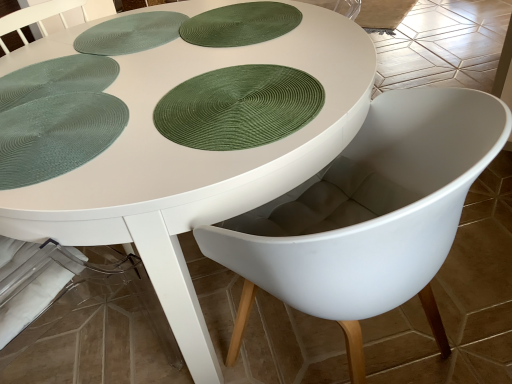
In order to click on white matte table at center in this screenshot , I will do `click(35, 14)`.

At what (x,y) coordinates should I click in order to perform the action: click on green woven placemat at center, which is counted as the third paper plate, starting from the top. Please return your answer as a coordinate pair (x, y). This screenshot has width=512, height=384. Looking at the image, I should click on (238, 107).

Where is `green textured placemat at upper left`? This screenshot has width=512, height=384. green textured placemat at upper left is located at coordinates coord(130,33).

Describe the element at coordinates (130, 33) in the screenshot. I see `green textured placemat at upper left` at that location.

At what (x,y) coordinates should I click in order to perform the action: click on green textured placemat at upper center, the 1th paper plate viewed from the top. Please return your answer as a coordinate pair (x, y). This screenshot has height=384, width=512. Looking at the image, I should click on (240, 24).

This screenshot has height=384, width=512. Identify the location of green textured placemat at upper left, which appears as the 3th paper plate when ordered from the bottom. (57, 79).

The height and width of the screenshot is (384, 512). What are the coordinates of `green textured placemat at left, marked as the fourth paper plate in a top-to-bottom arrangement` in the screenshot? It's located at (56, 135).

I want to click on white matte table at center, so pos(35,14).

Considering the positions of objects green textured placemat at upper left and white matte table at center in the image provided, who is behind, green textured placemat at upper left or white matte table at center?

Positioned behind is green textured placemat at upper left.

From a real-world perspective, is green textured placemat at upper left located beneath white matte table at center?

No, from a real-world perspective, green textured placemat at upper left is not beneath white matte table at center.

Which is behind, point (123, 22) or point (176, 307)?

Point (123, 22)

Is green textured placemat at upper left facing away from white matte table at center?

That's right, green textured placemat at upper left is facing away from white matte table at center.

Could you tell me if white matte table at center is facing green textured placemat at upper left?

No, white matte table at center is not facing towards green textured placemat at upper left.

Based on their positions, is white matte table at center located to the left or right of green textured placemat at upper left?

Based on their positions, white matte table at center is located to the right of green textured placemat at upper left.

From the image's perspective, which is above, white matte table at center or green textured placemat at upper left?

From the image's view, green textured placemat at upper left is above.

Locate an element on the screen. The height and width of the screenshot is (384, 512). the 4th paper plate directly above the green textured placemat at upper left (from a real-world perspective) is located at coordinates (56, 135).

Considering the positions of objects green textured placemat at left, marked as the first paper plate in a bottom-to-top arrangement, and green textured placemat at upper left in the image provided, who is in front, green textured placemat at left, marked as the first paper plate in a bottom-to-top arrangement, or green textured placemat at upper left?

green textured placemat at left, marked as the first paper plate in a bottom-to-top arrangement, is more forward.

From the picture: From a real-world perspective, which is physically above, green textured placemat at left, marked as the first paper plate in a bottom-to-top arrangement, or green textured placemat at upper left?

From a 3D spatial view, green textured placemat at left, marked as the first paper plate in a bottom-to-top arrangement, is above.

Is green textured placemat at left, marked as the fourth paper plate in a top-to-bottom arrangement, located outside green textured placemat at upper left?

Yes, green textured placemat at left, marked as the fourth paper plate in a top-to-bottom arrangement, is located beyond the bounds of green textured placemat at upper left.

From a real-world perspective, is green textured placemat at upper left physically above green woven placemat at center, which is counted as the second paper plate, starting from the bottom?

Actually, green textured placemat at upper left is physically below green woven placemat at center, which is counted as the second paper plate, starting from the bottom, in the real world.

Considering the sizes of objects green textured placemat at upper left and green woven placemat at center, which is counted as the third paper plate, starting from the top, in the image provided, who is wider, green textured placemat at upper left or green woven placemat at center, which is counted as the third paper plate, starting from the top,?

With larger width is green textured placemat at upper left.

Would you say green textured placemat at upper left is a long distance from green woven placemat at center, which is counted as the second paper plate, starting from the bottom?

No, green textured placemat at upper left is in close proximity to green woven placemat at center, which is counted as the second paper plate, starting from the bottom.

Is point (102, 33) closer or farther from the camera than point (292, 91)?

Clearly, point (102, 33) is more distant from the camera than point (292, 91).

Can you tell me how much green woven placemat at center, which is counted as the second paper plate, starting from the bottom, and green textured placemat at upper left differ in facing direction?

176 degrees separate the facing orientations of green woven placemat at center, which is counted as the second paper plate, starting from the bottom, and green textured placemat at upper left.

Between green woven placemat at center, which is counted as the second paper plate, starting from the bottom, and green textured placemat at upper left, which one has larger width?

green textured placemat at upper left.

Between green woven placemat at center, which is counted as the second paper plate, starting from the bottom, and green textured placemat at upper left, which one has less height?

Standing shorter between the two is green textured placemat at upper left.

Is green woven placemat at center, which is counted as the third paper plate, starting from the top, closer to the viewer compared to green textured placemat at upper left?

Yes, green woven placemat at center, which is counted as the third paper plate, starting from the top, is closer to the camera.

Considering the relative sizes of green textured placemat at left, marked as the first paper plate in a bottom-to-top arrangement, and green textured placemat at upper left, the 2th paper plate when ordered from top to bottom, in the image provided, is green textured placemat at left, marked as the first paper plate in a bottom-to-top arrangement, wider than green textured placemat at upper left, the 2th paper plate when ordered from top to bottom,?

Incorrect, the width of green textured placemat at left, marked as the first paper plate in a bottom-to-top arrangement, does not surpass that of green textured placemat at upper left, the 2th paper plate when ordered from top to bottom.

Which of these two, green textured placemat at left, marked as the fourth paper plate in a top-to-bottom arrangement, or green textured placemat at upper left, which appears as the 3th paper plate when ordered from the bottom, stands taller?

green textured placemat at left, marked as the fourth paper plate in a top-to-bottom arrangement, is taller.

Consider the image. Considering the positions of objects green textured placemat at left, marked as the fourth paper plate in a top-to-bottom arrangement, and green textured placemat at upper left, which appears as the 3th paper plate when ordered from the bottom, in the image provided, who is behind, green textured placemat at left, marked as the fourth paper plate in a top-to-bottom arrangement, or green textured placemat at upper left, which appears as the 3th paper plate when ordered from the bottom,?

green textured placemat at upper left, which appears as the 3th paper plate when ordered from the bottom, is behind.

Which is in front, white matte table at center or green textured placemat at left, marked as the first paper plate in a bottom-to-top arrangement?

white matte table at center is more forward.

Is point (143, 254) positioned behind point (70, 146)?

No, it is in front of (70, 146).

You are a GUI agent. You are given a task and a screenshot of the screen. Output one action in this format:
    pyautogui.click(x=<x>, y=<y>)
    Task: Click on the 1st paper plate to the left of the white matte table at center, starting your count from the anchor
    The image size is (512, 384).
    Given the screenshot: What is the action you would take?
    pyautogui.click(x=56, y=135)

Image resolution: width=512 pixels, height=384 pixels. In order to click on table beneath the green textured placemat at upper left (from a real-world perspective) in this screenshot , I will do `click(35, 14)`.

This screenshot has height=384, width=512. Find the location of `table below the green textured placemat at upper left (from the image's perspective)`. table below the green textured placemat at upper left (from the image's perspective) is located at coordinates [35, 14].

Estimate the real-world distances between objects in this image. Which object is closer to green woven placemat at center, which is counted as the second paper plate, starting from the bottom, green textured placemat at upper center, the 1th paper plate viewed from the top, or white matte poker table at center?

white matte poker table at center is positioned closer to the anchor green woven placemat at center, which is counted as the second paper plate, starting from the bottom.

Estimate the real-world distances between objects in this image. Which object is further from green textured placemat at upper center, arranged as the 4th paper plate when ordered from the bottom, green woven placemat at center, which is counted as the second paper plate, starting from the bottom, or green textured placemat at left, marked as the first paper plate in a bottom-to-top arrangement?

green textured placemat at left, marked as the first paper plate in a bottom-to-top arrangement, is positioned further to the anchor green textured placemat at upper center, arranged as the 4th paper plate when ordered from the bottom.

Considering their positions, is green woven placemat at center, which is counted as the second paper plate, starting from the bottom, positioned further to white matte table at center than green textured placemat at upper center, the 1th paper plate viewed from the top?

Based on the image, green woven placemat at center, which is counted as the second paper plate, starting from the bottom, appears to be further to white matte table at center.

Based on their spatial positions, is white matte table at center or green textured placemat at upper left, the 2th paper plate when ordered from top to bottom, closer to green textured placemat at left, marked as the first paper plate in a bottom-to-top arrangement?

green textured placemat at upper left, the 2th paper plate when ordered from top to bottom, is positioned closer to the anchor green textured placemat at left, marked as the first paper plate in a bottom-to-top arrangement.

Which object lies further to the anchor point green textured placemat at upper center, the 1th paper plate viewed from the top, white matte poker table at center or green textured placemat at upper left?

Based on the image, green textured placemat at upper left appears to be further to green textured placemat at upper center, the 1th paper plate viewed from the top.

Estimate the real-world distances between objects in this image. Which object is further from white plastic chair at center, green woven placemat at center, which is counted as the third paper plate, starting from the top, or green textured placemat at upper left, which appears as the 3th paper plate when ordered from the bottom?

green textured placemat at upper left, which appears as the 3th paper plate when ordered from the bottom, lies further to white plastic chair at center than the other object.

Which object lies nearer to the anchor point white plastic chair at center, green textured placemat at upper center, arranged as the 4th paper plate when ordered from the bottom, or white matte table at center?

green textured placemat at upper center, arranged as the 4th paper plate when ordered from the bottom.

Looking at the image, which one is located closer to green woven placemat at center, which is counted as the third paper plate, starting from the top, green textured placemat at upper left or white plastic chair at center?

white plastic chair at center.

This screenshot has height=384, width=512. I want to click on poker table positioned between green textured placemat at left, marked as the first paper plate in a bottom-to-top arrangement, and green textured placemat at upper left from near to far, so 57,121.

Where is `poker table between green textured placemat at upper left, which appears as the 3th paper plate when ordered from the bottom, and white plastic chair at center from left to right`? The width and height of the screenshot is (512, 384). poker table between green textured placemat at upper left, which appears as the 3th paper plate when ordered from the bottom, and white plastic chair at center from left to right is located at coordinates (57, 121).

Where is `table between green textured placemat at left, marked as the first paper plate in a bottom-to-top arrangement, and green woven placemat at center, which is counted as the third paper plate, starting from the top, in the horizontal direction`? table between green textured placemat at left, marked as the first paper plate in a bottom-to-top arrangement, and green woven placemat at center, which is counted as the third paper plate, starting from the top, in the horizontal direction is located at coordinates (35, 14).

The image size is (512, 384). I want to click on paper plate located between white matte poker table at center and green textured placemat at upper center, arranged as the 4th paper plate when ordered from the bottom, in the left-right direction, so click(56, 135).